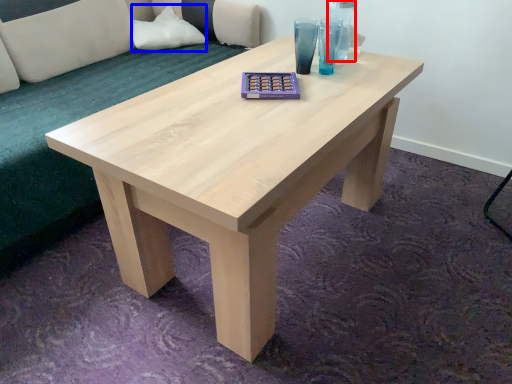
Question: Which point is closer to the camera, glass vase (highlighted by a red box) or pillow (highlighted by a blue box)?

Choices:
 (A) glass vase
 (B) pillow

Answer: (A)